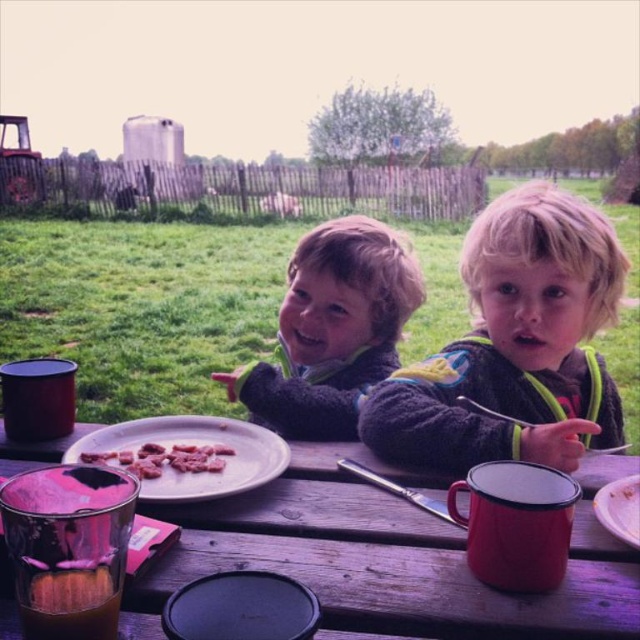
You are a photographer standing in front of the wooden table at center and the white matte plate at center. You want to take a photo that includes both objects but focuses on the one closer to you. Which object should you focus on?

The wooden table at center is closer to the viewer than the white matte plate at center, so you should focus on the wooden table at center.

Based on the photo, you are a photographer trying to capture a clear photo of the fluffy blonde hair at center and the soft gray sweater at center. Which object should you focus on first to ensure both are in focus?

The fluffy blonde hair at center is in front of the soft gray sweater at center, so you should focus on the fluffy blonde hair at center first to ensure both are in focus.